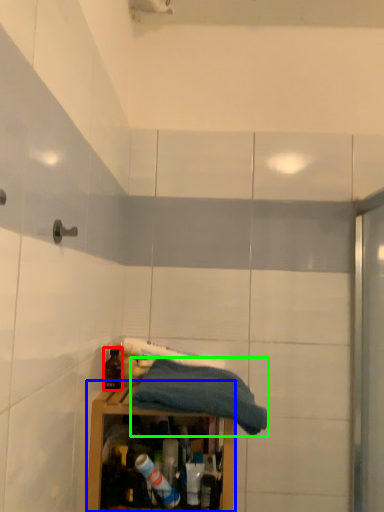
Question: Based on their relative distances, which object is farther from bottle (highlighted by a red box)? Choose from cabinetry (highlighted by a blue box) and towel (highlighted by a green box).

Choices:
 (A) cabinetry
 (B) towel

Answer: (B)